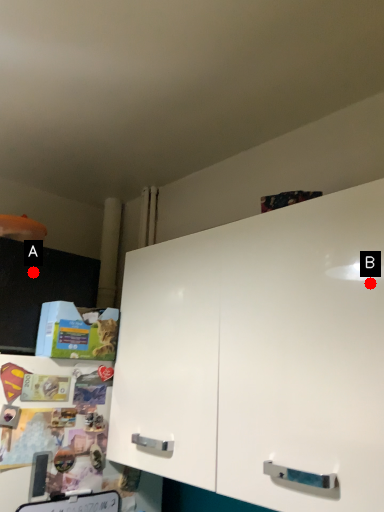
Question: Two points are circled on the image, labeled by A and B beside each circle. Which point is farther from the camera taking this photo?

Choices:
 (A) A is further
 (B) B is further

Answer: (A)